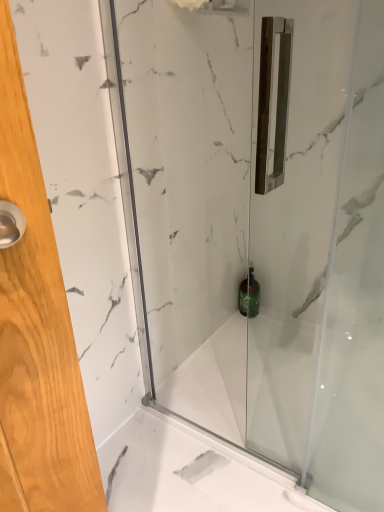
Locate an element on the screen. The height and width of the screenshot is (512, 384). transparent glass shower door at center is located at coordinates (260, 224).

Measure the distance between point (365, 312) and camera.

They are 34.84 inches apart.

What do you see at coordinates (260, 224) in the screenshot?
I see `transparent glass shower door at center` at bounding box center [260, 224].

Where is `green glass bottle at center`? green glass bottle at center is located at coordinates (249, 296).

Describe the element at coordinates (249, 296) in the screenshot. I see `green glass bottle at center` at that location.

This screenshot has height=512, width=384. I want to click on transparent glass shower door at center, so click(x=260, y=224).

Based on their positions, is green glass bottle at center located to the left or right of transparent glass shower door at center?

green glass bottle at center is positioned on transparent glass shower door at center's right side.

Relative to transparent glass shower door at center, is green glass bottle at center in front or behind?

green glass bottle at center is behind transparent glass shower door at center.

Which point is more distant from viewer, (258, 311) or (164, 56)?

The point (258, 311) is farther from the camera.

From the image's perspective, relative to transparent glass shower door at center, is green glass bottle at center above or below?

green glass bottle at center is below transparent glass shower door at center.

Based on the photo, from a real-world perspective, relative to transparent glass shower door at center, is green glass bottle at center vertically above or below?

green glass bottle at center is situated lower than transparent glass shower door at center in the real world.

Considering the sizes of objects green glass bottle at center and transparent glass shower door at center in the image provided, who is wider, green glass bottle at center or transparent glass shower door at center?

green glass bottle at center is wider.

From their relative heights in the image, would you say green glass bottle at center is taller or shorter than transparent glass shower door at center?

Considering their sizes, green glass bottle at center has less height than transparent glass shower door at center.

Who is smaller, green glass bottle at center or transparent glass shower door at center?

Smaller between the two is green glass bottle at center.

Based on the photo, would you say green glass bottle at center is outside transparent glass shower door at center?

Indeed, green glass bottle at center is completely outside transparent glass shower door at center.

Is there a large distance between green glass bottle at center and transparent glass shower door at center?

That's not correct — green glass bottle at center is a little close to transparent glass shower door at center.

Is green glass bottle at center positioned with its back to transparent glass shower door at center?

No.

Looking at this image, how many degrees apart are the facing directions of green glass bottle at center and transparent glass shower door at center?

0.0169 degrees separate the facing orientations of green glass bottle at center and transparent glass shower door at center.

Locate an element on the screen. The height and width of the screenshot is (512, 384). toiletry below the transparent glass shower door at center (from a real-world perspective) is located at coordinates (249, 296).

Is transparent glass shower door at center to the left or to the right of green glass bottle at center in the image?

From the image, it's evident that transparent glass shower door at center is to the left of green glass bottle at center.

Is transparent glass shower door at center in front of or behind green glass bottle at center in the image?

transparent glass shower door at center is positioned closer to the viewer than green glass bottle at center.

Which point is more distant from viewer, (146, 141) or (251, 277)?

The point (251, 277) is more distant.

From the image's perspective, is transparent glass shower door at center positioned above or below green glass bottle at center?

From the image's perspective, transparent glass shower door at center appears above green glass bottle at center.

From a real-world perspective, is transparent glass shower door at center located beneath green glass bottle at center?

No.

Between transparent glass shower door at center and green glass bottle at center, which one has larger width?

green glass bottle at center is wider.

Who is shorter, transparent glass shower door at center or green glass bottle at center?

green glass bottle at center is shorter.

Considering the sizes of objects transparent glass shower door at center and green glass bottle at center in the image provided, who is bigger, transparent glass shower door at center or green glass bottle at center?

With larger size is transparent glass shower door at center.

Do you think transparent glass shower door at center is within green glass bottle at center, or outside of it?

transparent glass shower door at center cannot be found inside green glass bottle at center.

From the picture: Is transparent glass shower door at center placed right next to green glass bottle at center?

No, transparent glass shower door at center is not with green glass bottle at center.

Is transparent glass shower door at center looking in the opposite direction of green glass bottle at center?

Yes, green glass bottle at center is at the back of transparent glass shower door at center.

How different are the orientations of transparent glass shower door at center and green glass bottle at center in degrees?

0.0169 degrees separate the facing orientations of transparent glass shower door at center and green glass bottle at center.

This screenshot has width=384, height=512. I want to click on shower door on the left of green glass bottle at center, so click(260, 224).

The image size is (384, 512). I want to click on toiletry behind the transparent glass shower door at center, so click(x=249, y=296).

Find the location of a particular element. This screenshot has height=512, width=384. toiletry below the transparent glass shower door at center (from a real-world perspective) is located at coordinates coord(249,296).